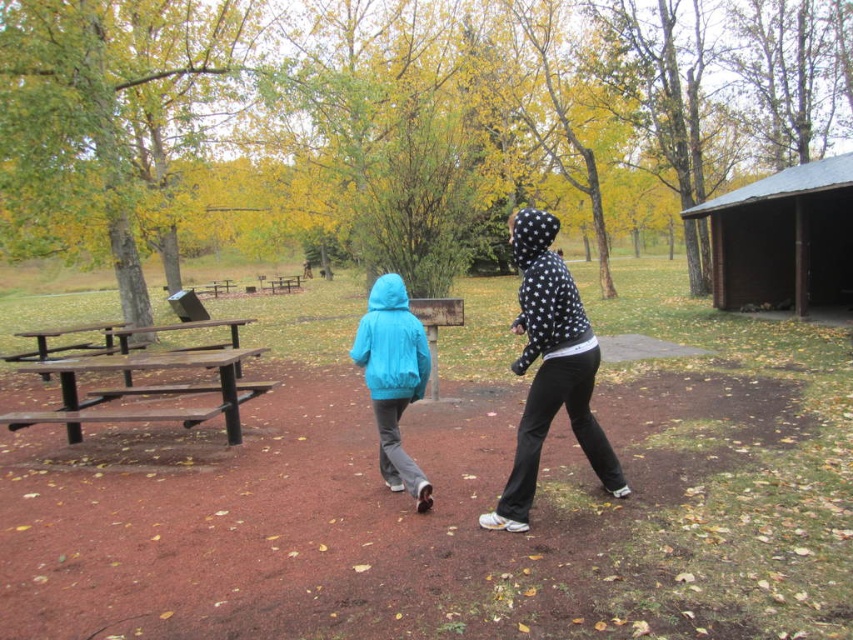
You are standing at the camera position and want to walk towards the brown wooden shed at right. Will you pass by the polka dot hoodie at center on your way there?

The brown wooden shed at right is positioned over the polka dot hoodie at center, meaning the shed is directly in front of the hoodie. Therefore, you will not pass by the polka dot hoodie at center on your way to the shed because the shed is blocking the path directly in front of it.

You are planning to set up a temporary tent in the park. The brown wooden shed at right and the matte blue jacket at center are in the way. Which object should you move to free up more space for the tent?

You should move the brown wooden shed at right because it occupies less space than the matte blue jacket at center, so removing it would free up more area for the tent.

Consider the image. You are standing at the camera position looking at the scene. There is a brown wooden shed at right and a polka dot hoodie at center. Which object is closer to you?

The brown wooden shed at right is closer to you because the polka dot hoodie at center is behind it.